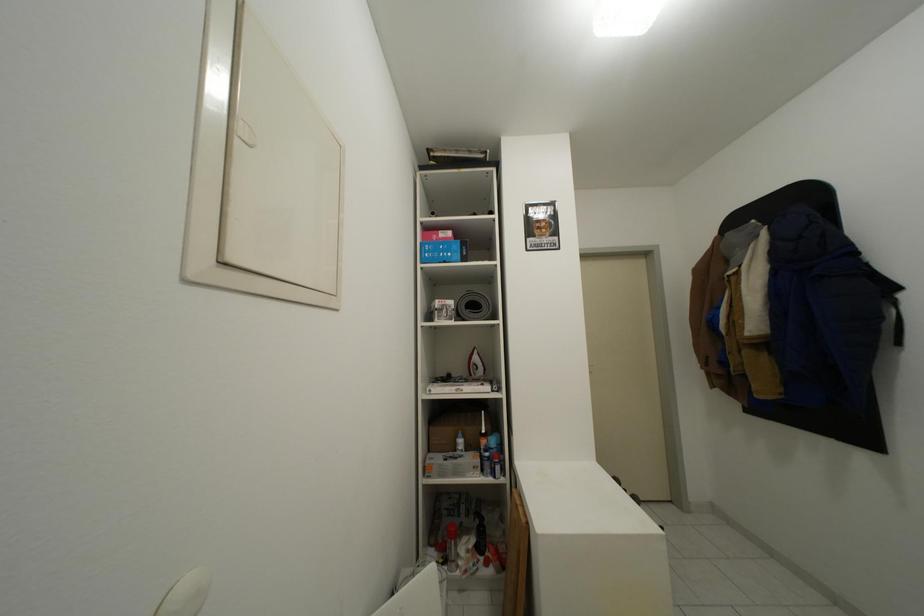
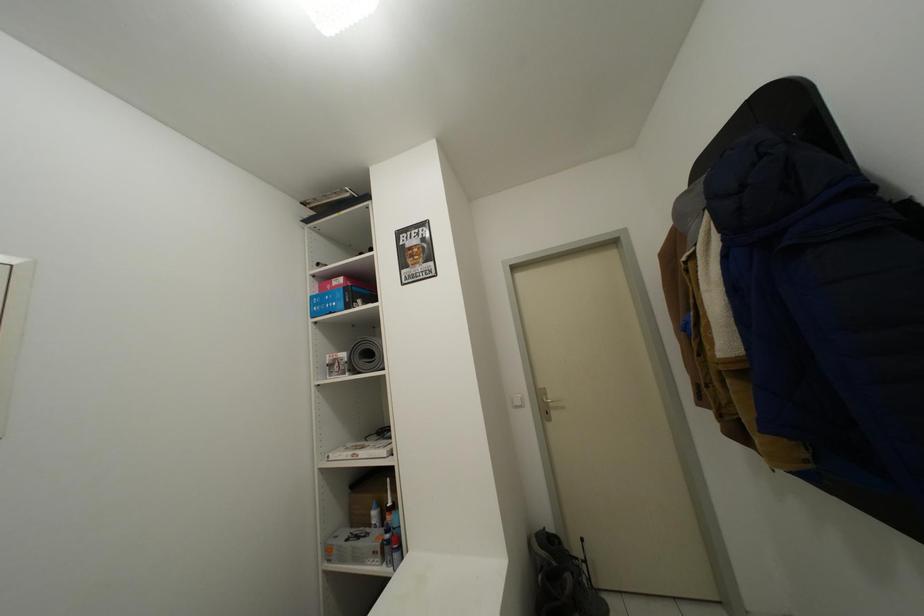
Question: The camera is either moving clockwise (left) or counter-clockwise (right) around the object. The first image is from the beginning of the video and the second image is from the end. Is the camera moving left or right when shooting the video?

Choices:
 (A) Left
 (B) Right

Answer: (B)